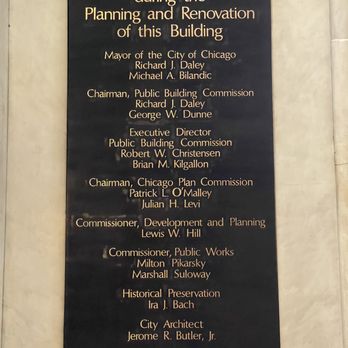
I want to click on wall, so click(x=293, y=47), click(x=307, y=102), click(x=307, y=166), click(x=306, y=223), click(x=30, y=246), click(x=27, y=200), click(x=27, y=159), click(x=26, y=133), click(x=26, y=93), click(x=26, y=67).